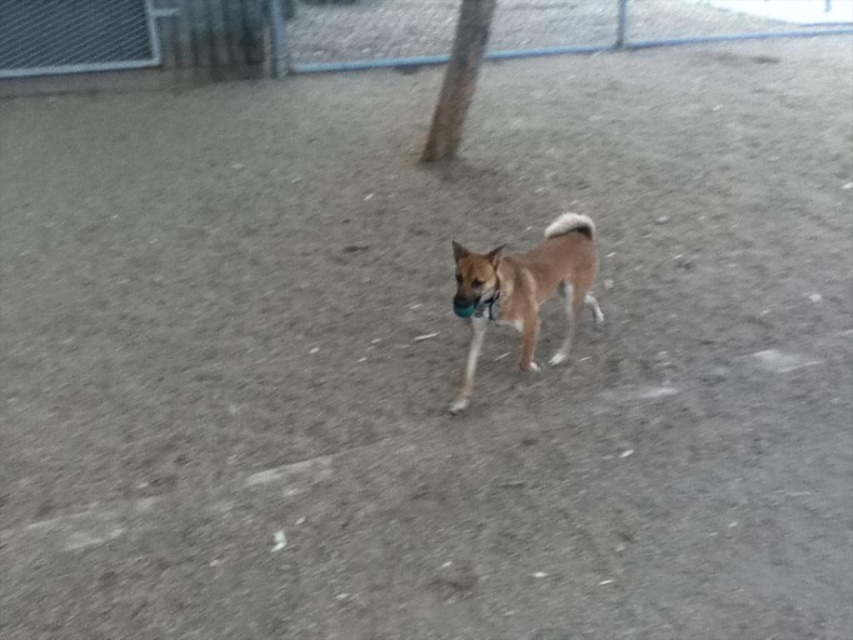
Is brushed metal fence at upper center shorter than brown furry dog at center?

Yes, brushed metal fence at upper center is shorter than brown furry dog at center.

Which of these two, brushed metal fence at upper center or brown furry dog at center, stands shorter?

brushed metal fence at upper center is shorter.

Identify the location of brushed metal fence at upper center. (213, 35).

Can you confirm if brown furry dog at center is positioned to the left of black fabric neckband at center?

In fact, brown furry dog at center is to the right of black fabric neckband at center.

Does brown furry dog at center have a greater width compared to black fabric neckband at center?

Correct, the width of brown furry dog at center exceeds that of black fabric neckband at center.

At what (x,y) coordinates should I click in order to perform the action: click on brown furry dog at center. Please return your answer as a coordinate pair (x, y). This screenshot has width=853, height=640. Looking at the image, I should click on (526, 291).

Can you confirm if brushed metal fence at upper left is shorter than black fabric neckband at center?

No.

Can you confirm if brushed metal fence at upper left is positioned above black fabric neckband at center?

Indeed, brushed metal fence at upper left is positioned over black fabric neckband at center.

The width and height of the screenshot is (853, 640). Find the location of `brushed metal fence at upper left`. brushed metal fence at upper left is located at coordinates (138, 36).

The image size is (853, 640). Find the location of `brushed metal fence at upper left`. brushed metal fence at upper left is located at coordinates coord(138,36).